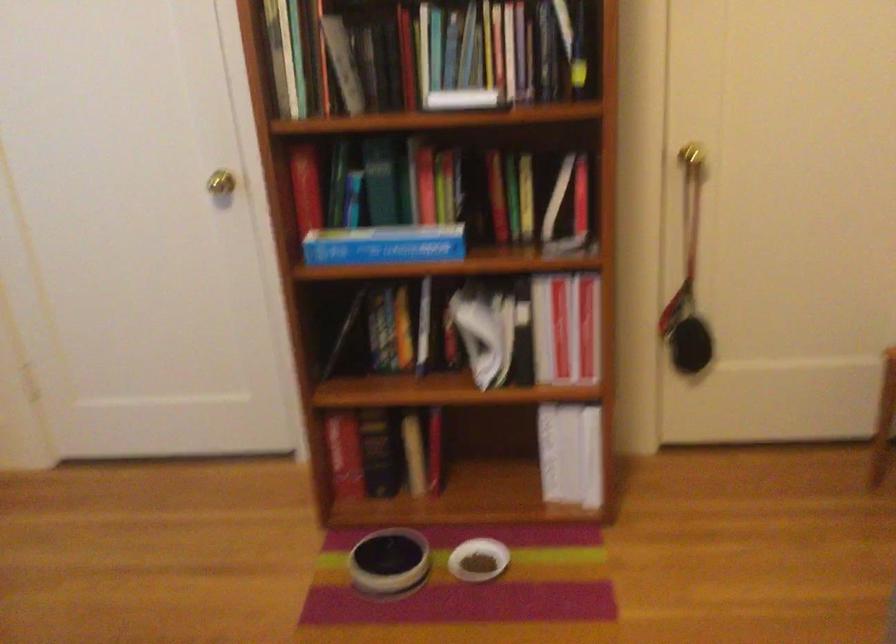
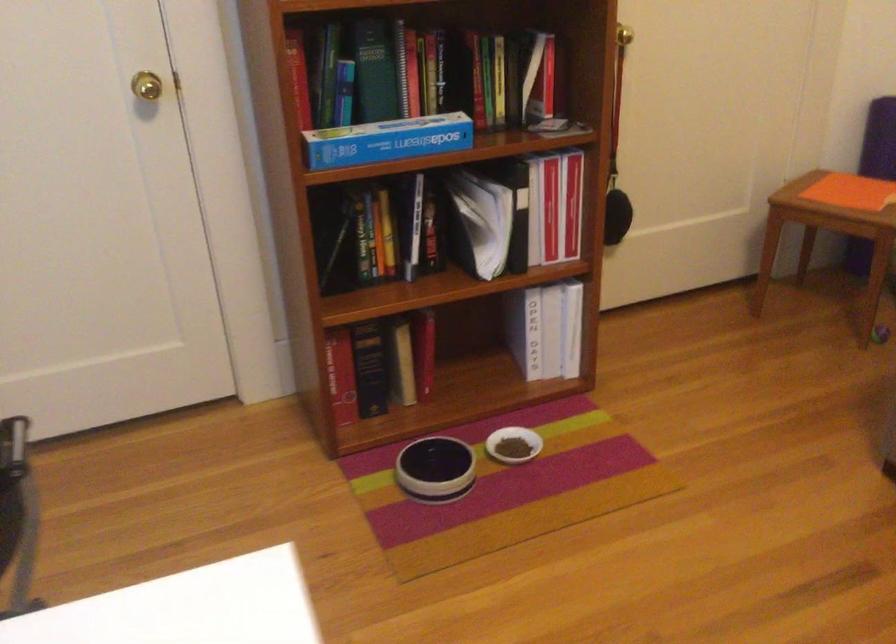
In the second image, find the point that corresponds to (485,332) in the first image.

(479, 222)